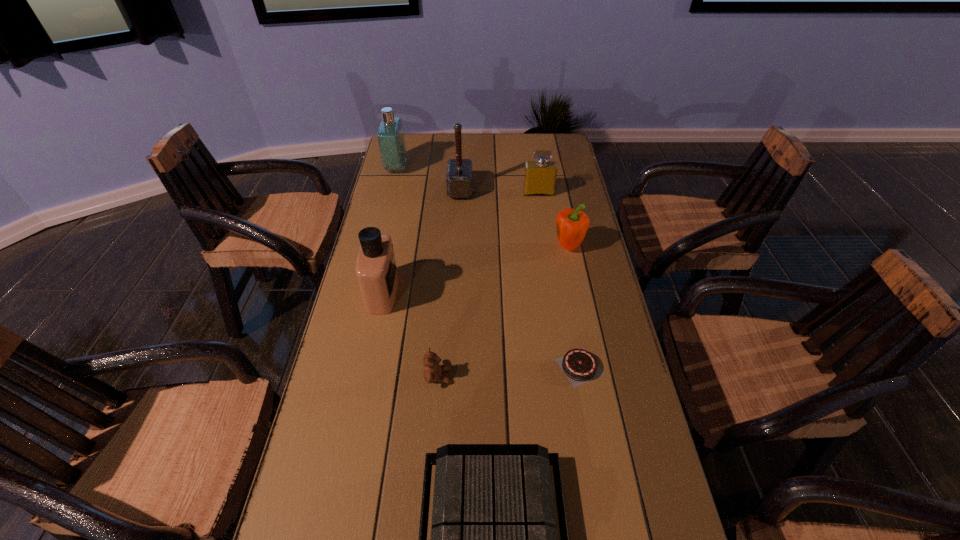
The width and height of the screenshot is (960, 540). I want to click on free spot located on the front label of the fifth farthest object, so click(x=504, y=293).

At what (x,y) coordinates should I click in order to perform the action: click on free space located on the front-facing side of the rightmost perfume. Please return your answer as a coordinate pair (x, y). This screenshot has width=960, height=540. Looking at the image, I should click on (x=542, y=215).

At what (x,y) coordinates should I click in order to perform the action: click on free space located on the left of the fifth nearest object. Please return your answer as a coordinate pair (x, y). The height and width of the screenshot is (540, 960). Looking at the image, I should click on (516, 247).

Find the location of a particular element. Image resolution: width=960 pixels, height=540 pixels. free location located on the face of the teddy bear is located at coordinates (552, 376).

The width and height of the screenshot is (960, 540). I want to click on free location located 0.150m on the left of the shortest object, so click(496, 367).

Where is `object that is at the far edge`? The height and width of the screenshot is (540, 960). object that is at the far edge is located at coordinates (390, 135).

Identify the location of perfume positioned at the right edge. This screenshot has width=960, height=540. (540, 176).

Locate an element on the screen. Image resolution: width=960 pixels, height=540 pixels. pepper located in the right edge section of the desktop is located at coordinates (572, 225).

Where is `chocolate cake that is at the right edge`? This screenshot has width=960, height=540. chocolate cake that is at the right edge is located at coordinates (580, 366).

I want to click on object present at the far left corner, so point(390,135).